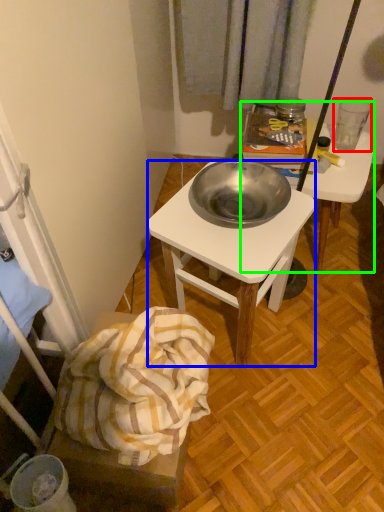
Question: Considering the real-world distances, which object is closest to coffee cup (highlighted by a red box)? desk (highlighted by a blue box) or desk (highlighted by a green box).

Choices:
 (A) desk
 (B) desk

Answer: (B)